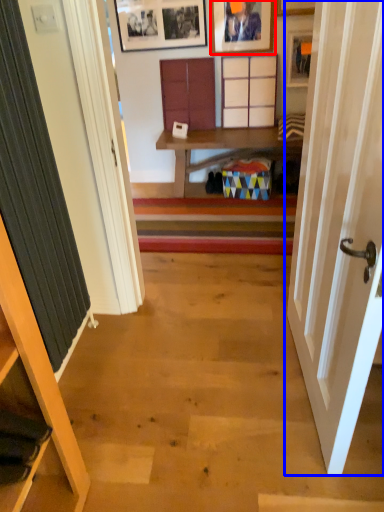
Question: Among these objects, which one is nearest to the camera, picture frame (highlighted by a red box) or door (highlighted by a blue box)?

Choices:
 (A) picture frame
 (B) door

Answer: (B)